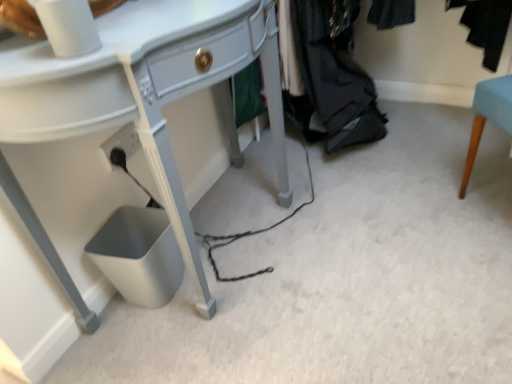
Locate an element on the screen. Image resolution: width=512 pixels, height=384 pixels. vacant space underneath matte white desk at center (from a real-world perspective) is located at coordinates (237, 236).